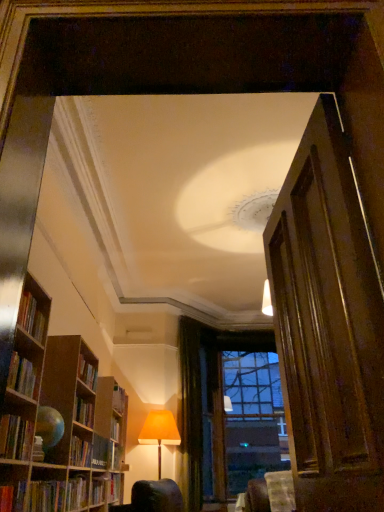
Question: Can we say orange fabric lampshade at lower center lies outside hardcover book at left, the 1th book in the front-to-back sequence?

Choices:
 (A) yes
 (B) no

Answer: (A)

Question: Is orange fabric lampshade at lower center aimed at hardcover book at left, which appears as the third book when ordered from the bottom?

Choices:
 (A) yes
 (B) no

Answer: (A)

Question: Does orange fabric lampshade at lower center appear on the left side of hardcover book at left, which appears as the third book when ordered from the bottom?

Choices:
 (A) yes
 (B) no

Answer: (B)

Question: Does orange fabric lampshade at lower center appear on the right side of hardcover book at left, marked as the fifth book in a back-to-front arrangement?

Choices:
 (A) no
 (B) yes

Answer: (B)

Question: From the image's perspective, is orange fabric lampshade at lower center located beneath hardcover book at left, which appears as the third book when ordered from the bottom?

Choices:
 (A) yes
 (B) no

Answer: (A)

Question: From a real-world perspective, is orange fabric lampshade at lower center located beneath hardcover book at left, the third book positioned from the top?

Choices:
 (A) yes
 (B) no

Answer: (B)

Question: Is green velvet curtain at center completely or partially inside hardcover book at lower left, the 4th book from the top?

Choices:
 (A) yes
 (B) no

Answer: (B)

Question: Is green velvet curtain at center at the back of hardcover book at lower left, the 4th book from the top?

Choices:
 (A) yes
 (B) no

Answer: (B)

Question: Does hardcover book at lower left, which is the 2th book from bottom to top, have a lesser width compared to green velvet curtain at center?

Choices:
 (A) yes
 (B) no

Answer: (A)

Question: Are hardcover book at lower left, the 4th book from the top, and green velvet curtain at center far apart?

Choices:
 (A) no
 (B) yes

Answer: (B)

Question: Is hardcover book at lower left, which is the 2th book from bottom to top, at the left side of green velvet curtain at center?

Choices:
 (A) yes
 (B) no

Answer: (A)

Question: Is the surface of hardcover book at lower left, which is the 2th book from bottom to top, in direct contact with green velvet curtain at center?

Choices:
 (A) yes
 (B) no

Answer: (B)

Question: Is orange fabric lampshade at lower center not within hardcover book at lower left, arranged as the fourth book when viewed from the front?

Choices:
 (A) no
 (B) yes

Answer: (B)